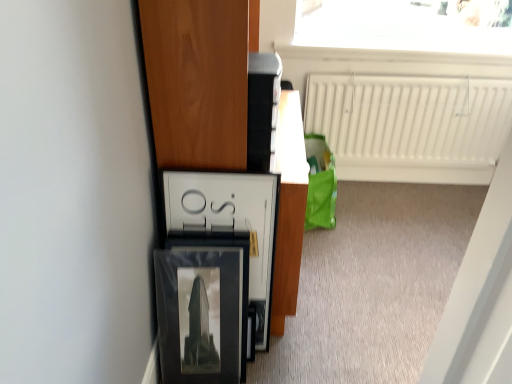
Question: Should I look upward or downward to see white glossy frame at center?

Choices:
 (A) up
 (B) down

Answer: (B)

Question: Is wooden cabinet at left oriented away from white matte radiator at upper right?

Choices:
 (A) no
 (B) yes

Answer: (A)

Question: Does wooden cabinet at left have a lesser width compared to white matte radiator at upper right?

Choices:
 (A) yes
 (B) no

Answer: (B)

Question: From the image's perspective, would you say wooden cabinet at left is positioned over white matte radiator at upper right?

Choices:
 (A) yes
 (B) no

Answer: (B)

Question: Can you confirm if wooden cabinet at left is positioned to the left of white matte radiator at upper right?

Choices:
 (A) yes
 (B) no

Answer: (A)

Question: Does wooden cabinet at left appear on the right side of white matte radiator at upper right?

Choices:
 (A) yes
 (B) no

Answer: (B)

Question: Does wooden cabinet at left have a larger size compared to white matte radiator at upper right?

Choices:
 (A) yes
 (B) no

Answer: (A)

Question: Is the depth of white matte radiator at upper right less than that of wooden cabinet at left?

Choices:
 (A) yes
 (B) no

Answer: (B)

Question: From a real-world perspective, does white matte radiator at upper right stand above wooden cabinet at left?

Choices:
 (A) no
 (B) yes

Answer: (A)

Question: From a real-world perspective, is white matte radiator at upper right under wooden cabinet at left?

Choices:
 (A) no
 (B) yes

Answer: (B)

Question: Is white matte radiator at upper right oriented away from wooden cabinet at left?

Choices:
 (A) no
 (B) yes

Answer: (A)

Question: Is white matte radiator at upper right shorter than wooden cabinet at left?

Choices:
 (A) no
 (B) yes

Answer: (B)

Question: Is white matte radiator at upper right thinner than wooden cabinet at left?

Choices:
 (A) no
 (B) yes

Answer: (B)

Question: Does wooden cabinet at left have a smaller size compared to matte black picture frame at lower left?

Choices:
 (A) yes
 (B) no

Answer: (B)